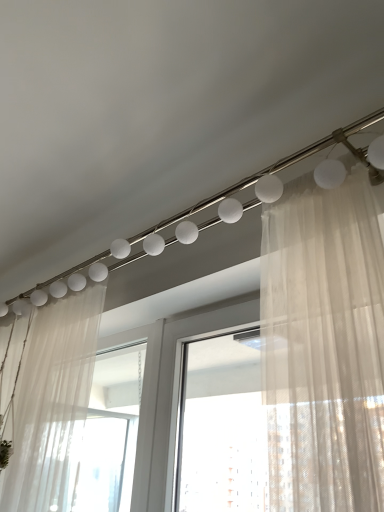
Image resolution: width=384 pixels, height=512 pixels. Describe the element at coordinates (52, 403) in the screenshot. I see `sheer white curtain at left` at that location.

What is the approximate width of sheer white curtain at left?

sheer white curtain at left is 11.71 inches in width.

Where is `sheer white curtain at left`? sheer white curtain at left is located at coordinates (52, 403).

What is the approximate height of sheer white curtain at left?

sheer white curtain at left is 33.22 inches in height.

Measure the distance between point (64, 371) and camera.

A distance of 4.80 feet exists between point (64, 371) and camera.

This screenshot has height=512, width=384. What are the coordinates of `sheer white curtain at left` in the screenshot? It's located at (52, 403).